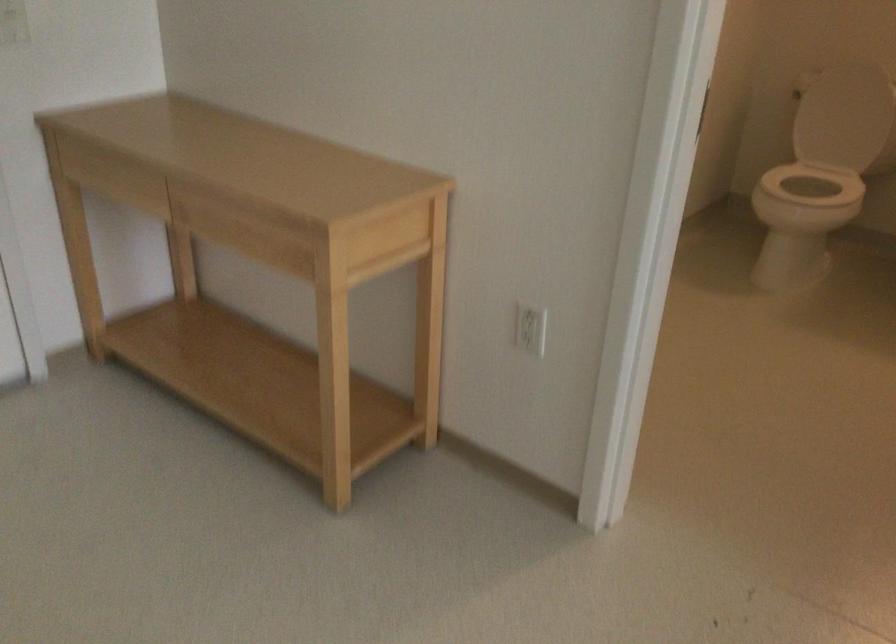
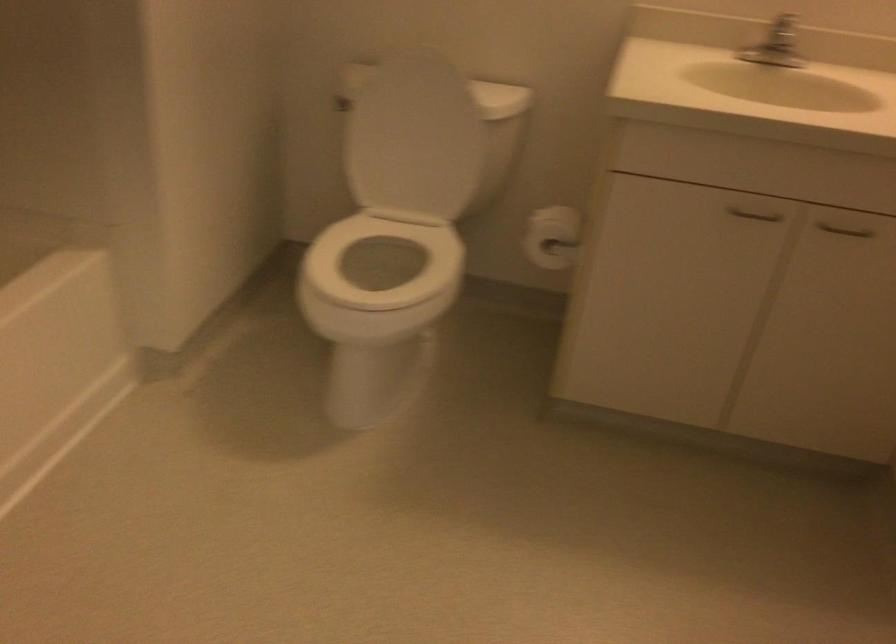
In a continuous first-person perspective shot, in which direction is the camera moving?

The cameraman moved toward right, forward.